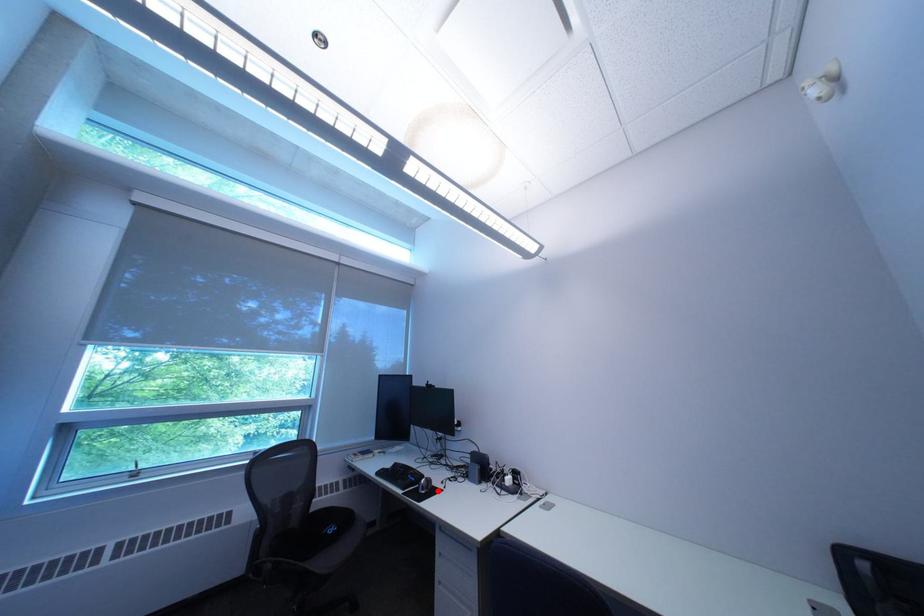
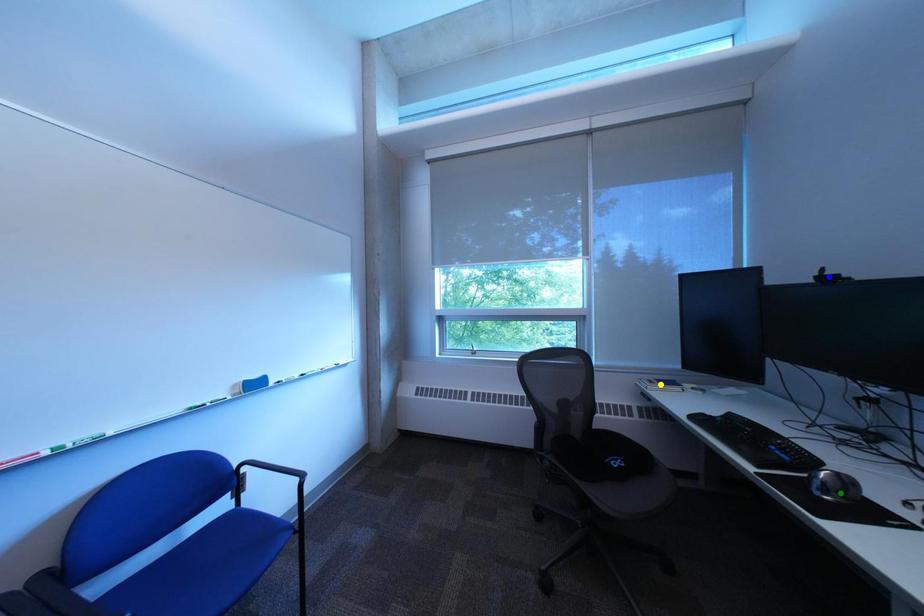
Question: I am providing you with two images of the same scene from different viewpoints. A red point is marked on the first image. You are given multiple points on the second image. In image 2, which mark is for the same physical point as the one in image 1?

Choices:
 (A) blue point
 (B) yellow point
 (C) green point

Answer: (C)